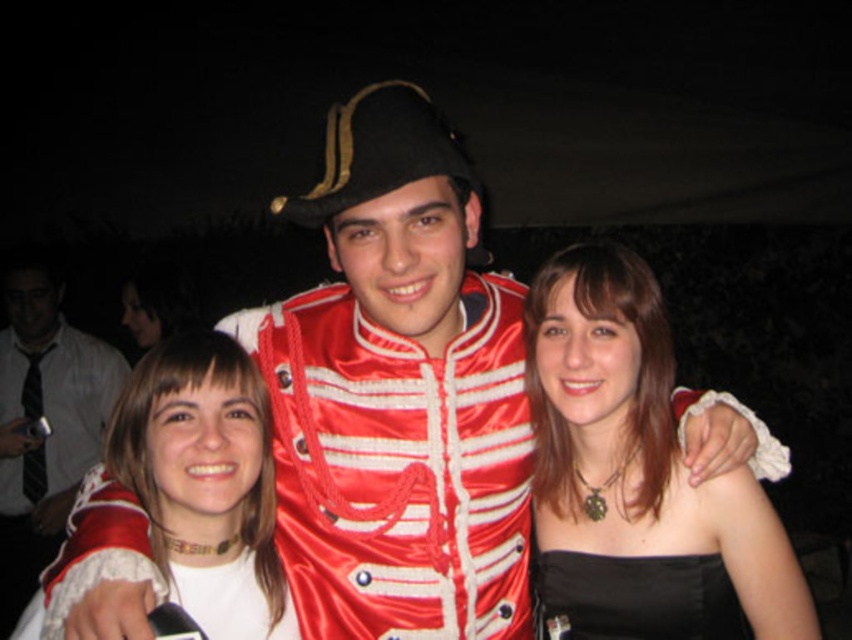
Between point (563, 394) and point (256, 433), which one is positioned in front?

Point (256, 433)

Who is positioned more to the left, black satin dress at center or white satin blouse at left?

white satin blouse at left

Is point (646, 460) positioned behind point (252, 433)?

Yes, point (646, 460) is behind point (252, 433).

Where is `black satin dress at center`? black satin dress at center is located at coordinates (637, 476).

Which is below, matte white lace at left or black satin dress at lower right?

matte white lace at left is below.

Can you confirm if matte white lace at left is wider than black satin dress at lower right?

Yes, matte white lace at left is wider than black satin dress at lower right.

This screenshot has width=852, height=640. What do you see at coordinates (49, 422) in the screenshot? I see `matte white lace at left` at bounding box center [49, 422].

Locate an element on the screen. The height and width of the screenshot is (640, 852). matte white lace at left is located at coordinates (49, 422).

Which is above, black satin dress at center or matte white lace at left?

black satin dress at center

Is point (746, 467) farther from viewer compared to point (50, 369)?

That is False.

I want to click on black satin dress at center, so click(637, 476).